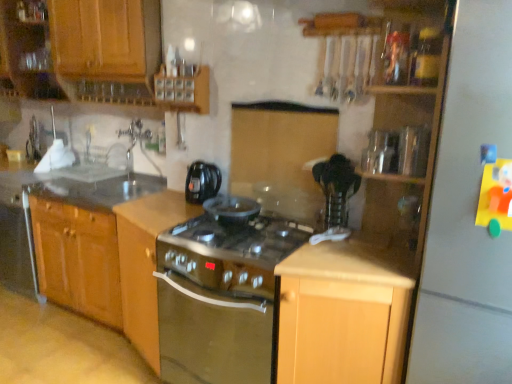
Question: From the image's perspective, is satin wood stove at center, which appears as the second cabinetry when viewed from the left, located above or below wooden cabinet at upper left, which is the fourth cabinetry in right-to-left order?

Choices:
 (A) below
 (B) above

Answer: (A)

Question: Is point (120, 220) positioned closer to the camera than point (17, 6)?

Choices:
 (A) farther
 (B) closer

Answer: (B)

Question: Which object is the farthest from the clear glass sink at upper left?

Choices:
 (A) satin wood stove at center, which appears as the second cabinetry when viewed from the left
 (B) clear plastic container at upper right, which is the second appliance in back-to-front order
 (C) white matte refrigerator at right
 (D) light wood cabinet at center, the first cabinetry in the right-to-left sequence
 (E) smooth granite countertop at left

Answer: (C)

Question: Which of these objects is positioned closest to the clear glass sink at upper left?

Choices:
 (A) clear plastic container at upper right, which is the second appliance in back-to-front order
 (B) smooth granite countertop at left
 (C) metallic silver toaster at upper right, the first appliance viewed from the back
 (D) satin silver oven at center
 (E) light wood cabinet at center, the first cabinetry in the right-to-left sequence

Answer: (B)